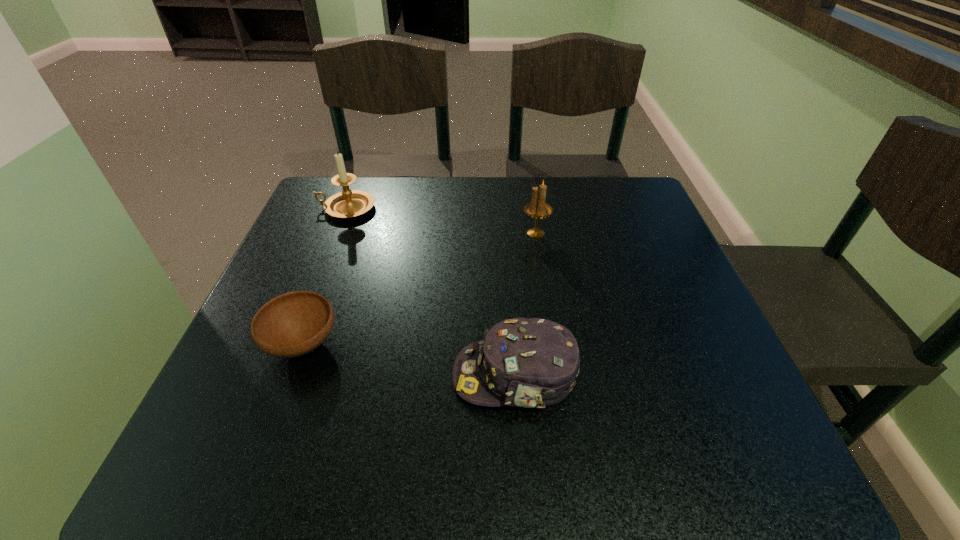
This screenshot has width=960, height=540. Find the location of `vacant space situated 0.160m on the front of the shortest object`. vacant space situated 0.160m on the front of the shortest object is located at coordinates (257, 468).

Find the location of a particular element. This screenshot has height=540, width=960. candle holder that is at the left edge is located at coordinates (349, 203).

Locate an element on the screen. bowl that is at the left edge is located at coordinates (293, 324).

In order to click on object that is positioned at the far left corner in this screenshot , I will do `click(349, 203)`.

What are the coordinates of `vacant space at the far edge of the desktop` in the screenshot? It's located at (494, 207).

In the image, there is a desktop. At what (x,y) coordinates should I click in order to perform the action: click on vacant space at the near edge. Please return your answer as a coordinate pair (x, y). Looking at the image, I should click on (367, 424).

At what (x,y) coordinates should I click in order to perform the action: click on vacant area at the left edge of the desktop. Please return your answer as a coordinate pair (x, y). This screenshot has height=540, width=960. Looking at the image, I should click on (281, 294).

At what (x,y) coordinates should I click in order to perform the action: click on vacant space at the right edge of the desktop. Please return your answer as a coordinate pair (x, y). This screenshot has height=540, width=960. Looking at the image, I should click on (657, 407).

Where is `vacant space at the far left corner of the desktop`? vacant space at the far left corner of the desktop is located at coordinates (324, 181).

Locate an element on the screen. Image resolution: width=960 pixels, height=540 pixels. free region at the far right corner is located at coordinates (625, 207).